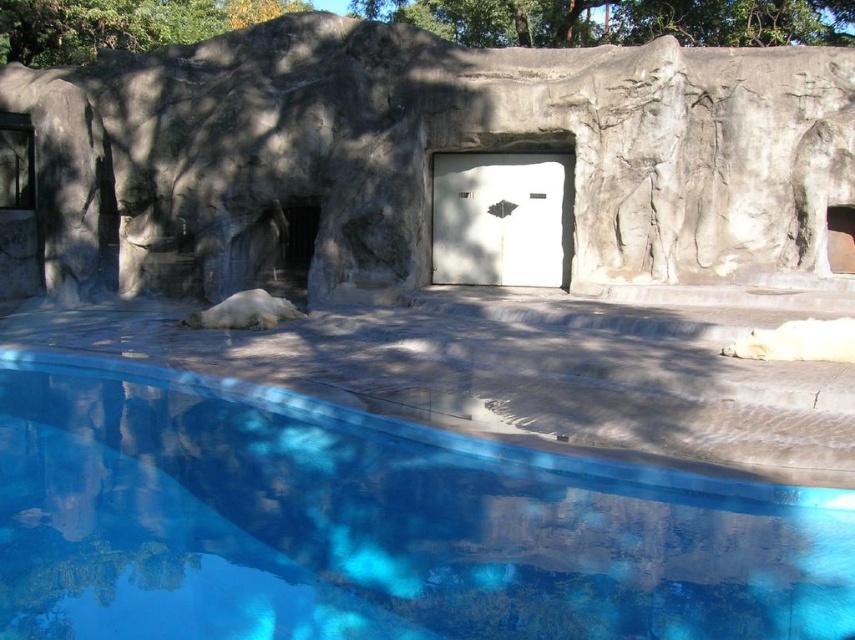
Question: Based on their relative distances, which object is farther from the blue smooth water at lower center?

Choices:
 (A) gray stone wall at center
 (B) green leafy tree at upper center

Answer: (B)

Question: Which is nearer to the gray stone wall at center?

Choices:
 (A) blue smooth water at lower center
 (B) green leafy tree at upper center

Answer: (B)

Question: Does gray stone wall at center appear under green leafy tree at upper center?

Choices:
 (A) yes
 (B) no

Answer: (A)

Question: Which object is closer to the camera taking this photo?

Choices:
 (A) blue smooth water at lower center
 (B) gray stone wall at center

Answer: (A)

Question: Can you confirm if blue smooth water at lower center is positioned to the left of green leafy tree at upper center?

Choices:
 (A) no
 (B) yes

Answer: (B)

Question: Is blue smooth water at lower center bigger than gray stone wall at center?

Choices:
 (A) no
 (B) yes

Answer: (A)